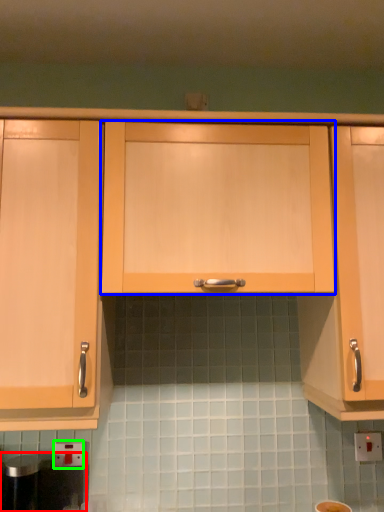
Question: Based on their relative distances, which object is nearer to appliance (highlighted by a red box)? Choose from cabinetry (highlighted by a blue box) and electric outlet (highlighted by a green box).

Choices:
 (A) cabinetry
 (B) electric outlet

Answer: (B)